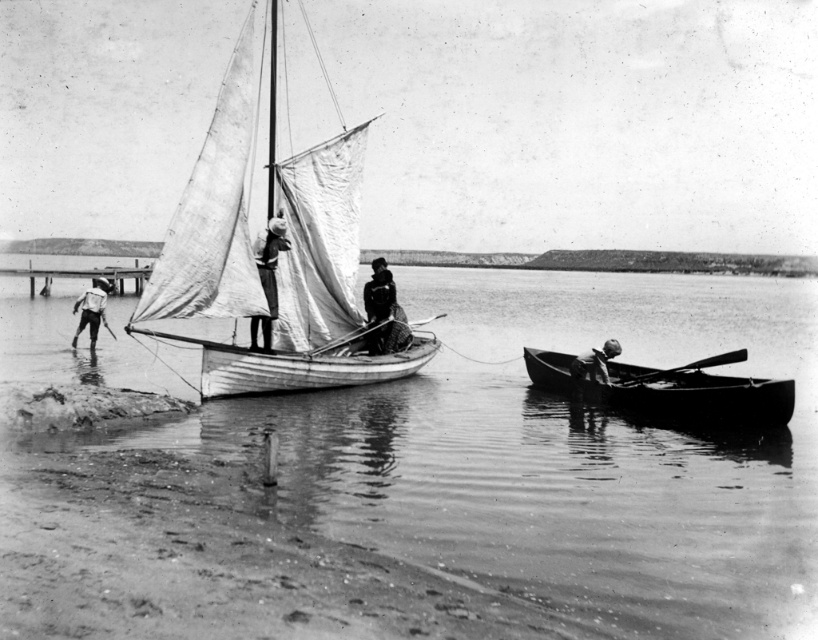
Question: Considering the relative positions of clear water at center and light brown wooden stick at lower left in the image provided, where is clear water at center located with respect to light brown wooden stick at lower left?

Choices:
 (A) left
 (B) right

Answer: (B)

Question: Does clear water at center have a smaller size compared to white cloth sail at center?

Choices:
 (A) no
 (B) yes

Answer: (A)

Question: Which point appears closest to the camera in this image?

Choices:
 (A) (261, 362)
 (B) (272, 305)
 (C) (614, 346)
 (D) (390, 273)

Answer: (A)

Question: Which point is farther from the camera taking this photo?

Choices:
 (A) [x=616, y=372]
 (B) [x=329, y=332]

Answer: (A)

Question: Can you confirm if clear water at center is bigger than smooth dark wood canoe at lower right?

Choices:
 (A) yes
 (B) no

Answer: (A)

Question: Considering the real-world distances, which object is closest to the clear water at center?

Choices:
 (A) wooden sailboat at center
 (B) smooth wooden paddle at lower right
 (C) smooth dark wood canoe at lower right

Answer: (B)